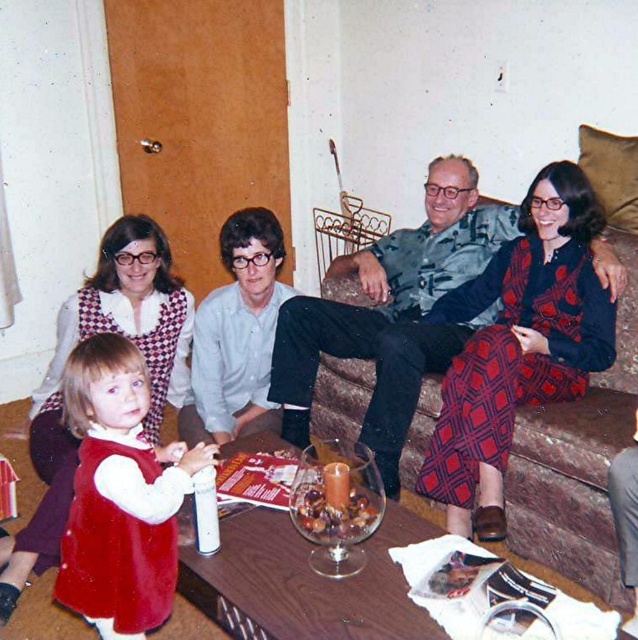
Consider the image. Between patterned fabric dress at center and velvet red dress at lower left, which one appears on the right side from the viewer's perspective?

patterned fabric dress at center

Is point (417, 282) positioned behind point (128, 412)?

Yes, it is.

This screenshot has height=640, width=638. What are the coordinates of `patterned fabric dress at center` in the screenshot? It's located at (392, 312).